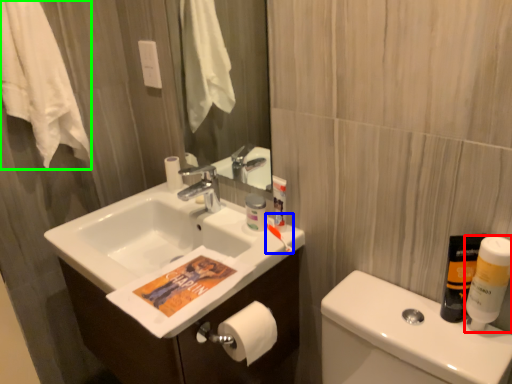
Question: Estimate the real-world distances between objects in this image. Which object is closer to mouthwash (highlighted by a red box), toothbrush (highlighted by a blue box) or bath towel (highlighted by a green box)?

Choices:
 (A) toothbrush
 (B) bath towel

Answer: (A)